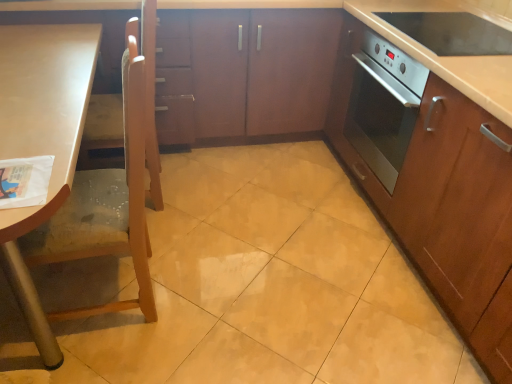
Question: Does metallic oven at right have a greater width compared to satin wood oven at right, which is counted as the second cabinetry, starting from the left?

Choices:
 (A) yes
 (B) no

Answer: (B)

Question: Is satin wood oven at right, which is counted as the second cabinetry, starting from the left, located within metallic oven at right?

Choices:
 (A) no
 (B) yes

Answer: (A)

Question: Is metallic oven at right positioned beyond the bounds of satin wood oven at right, the first cabinetry from the right?

Choices:
 (A) yes
 (B) no

Answer: (B)

Question: Considering the relative sizes of metallic oven at right and satin wood oven at right, the first cabinetry from the right, in the image provided, is metallic oven at right taller than satin wood oven at right, the first cabinetry from the right,?

Choices:
 (A) yes
 (B) no

Answer: (B)

Question: From a real-world perspective, is metallic oven at right under satin wood oven at right, which is counted as the second cabinetry, starting from the left?

Choices:
 (A) no
 (B) yes

Answer: (A)

Question: Visually, is satin wood countertop at right positioned to the left or to the right of light brown wood chair at left?

Choices:
 (A) right
 (B) left

Answer: (A)

Question: Is satin wood countertop at right bigger or smaller than light brown wood chair at left?

Choices:
 (A) big
 (B) small

Answer: (A)

Question: Considering the positions of satin wood countertop at right and light brown wood chair at left in the image, is satin wood countertop at right wider or thinner than light brown wood chair at left?

Choices:
 (A) wide
 (B) thin

Answer: (A)

Question: Considering the positions of satin wood countertop at right and light brown wood chair at left in the image, is satin wood countertop at right taller or shorter than light brown wood chair at left?

Choices:
 (A) short
 (B) tall

Answer: (A)

Question: Considering the positions of metallic oven at right and satin wood countertop at right in the image, is metallic oven at right wider or thinner than satin wood countertop at right?

Choices:
 (A) thin
 (B) wide

Answer: (A)

Question: Based on their positions, is metallic oven at right located to the left or right of satin wood countertop at right?

Choices:
 (A) left
 (B) right

Answer: (B)

Question: From a real-world perspective, relative to satin wood countertop at right, is metallic oven at right vertically above or below?

Choices:
 (A) above
 (B) below

Answer: (A)

Question: Is metallic oven at right situated inside satin wood countertop at right or outside?

Choices:
 (A) inside
 (B) outside

Answer: (B)

Question: In terms of height, does light brown wood chair at left look taller or shorter compared to metallic oven at right?

Choices:
 (A) tall
 (B) short

Answer: (A)

Question: Is light brown wood chair at left inside or outside of metallic oven at right?

Choices:
 (A) inside
 (B) outside

Answer: (B)